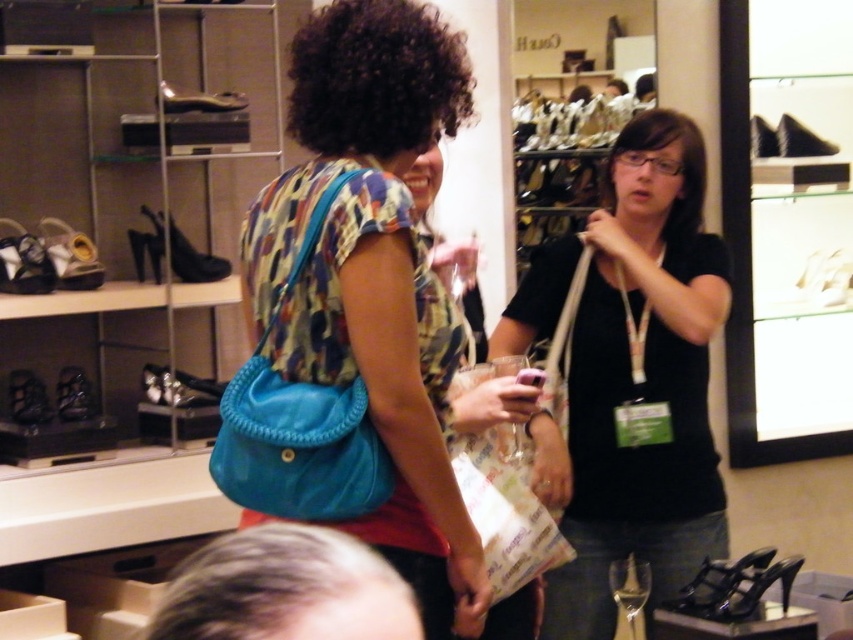
Question: Which point is closer to the camera taking this photo?

Choices:
 (A) (672, 234)
 (B) (321, 312)
 (C) (459, 112)

Answer: (B)

Question: Is matte blue bag at center to the left of white paper bag at center from the viewer's perspective?

Choices:
 (A) no
 (B) yes

Answer: (B)

Question: Which of these objects is positioned closest to the black matte bag at center?

Choices:
 (A) white paper bag at center
 (B) black matte afro at upper center
 (C) black curly hair at center
 (D) matte blue fabric bag at center

Answer: (A)

Question: Which object is the closest to the black matte bag at center?

Choices:
 (A) black curly hair at center
 (B) matte blue fabric bag at center

Answer: (B)

Question: Does matte blue bag at center have a larger size compared to matte blue fabric bag at center?

Choices:
 (A) no
 (B) yes

Answer: (B)

Question: Is matte blue fabric bag at center smaller than black matte afro at upper center?

Choices:
 (A) yes
 (B) no

Answer: (B)